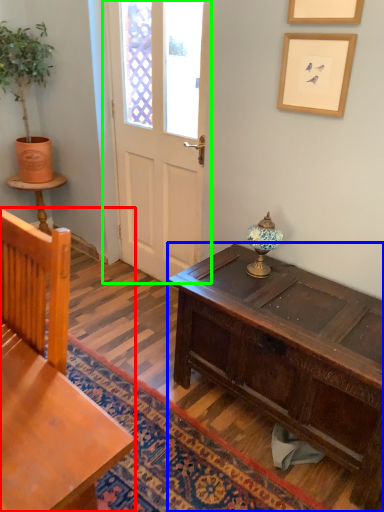
Question: Considering the real-world distances, which object is closest to chair (highlighted by a red box)? desk (highlighted by a blue box) or door (highlighted by a green box).

Choices:
 (A) desk
 (B) door

Answer: (A)